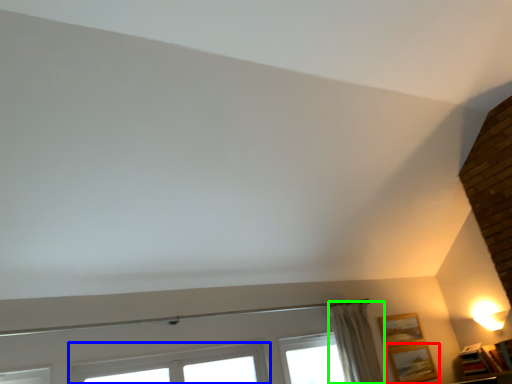
Question: Which is farther away from picture frame (highlighted by a red box)? window (highlighted by a blue box) or curtain (highlighted by a green box)?

Choices:
 (A) window
 (B) curtain

Answer: (A)